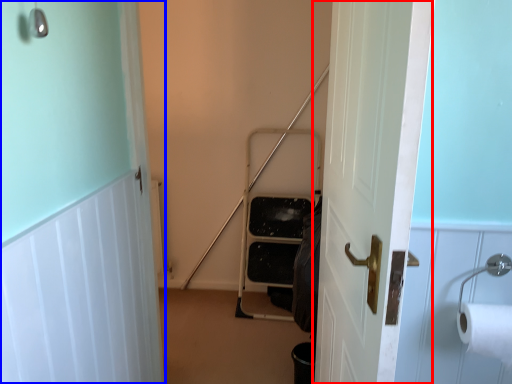
Question: Which object appears farthest to the camera in this image, door (highlighted by a red box) or door (highlighted by a blue box)?

Choices:
 (A) door
 (B) door

Answer: (B)